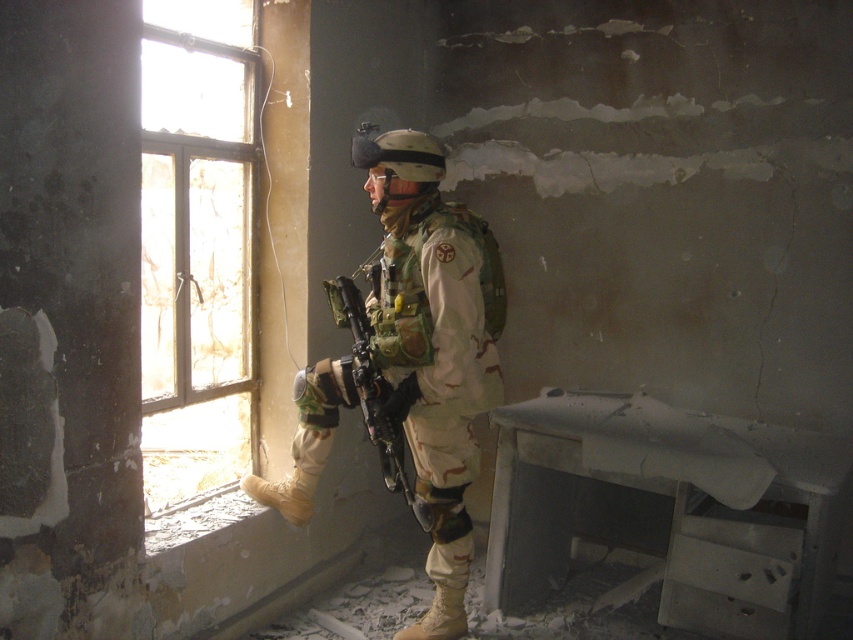
Is clear glass window at left above camouflage uniform at center?

Yes, clear glass window at left is above camouflage uniform at center.

Is clear glass window at left bigger than camouflage uniform at center?

Answer: Correct, clear glass window at left is larger in size than camouflage uniform at center.

Describe the element at coordinates (196, 244) in the screenshot. This screenshot has height=640, width=853. I see `clear glass window at left` at that location.

Identify the location of clear glass window at left. This screenshot has width=853, height=640. (196, 244).